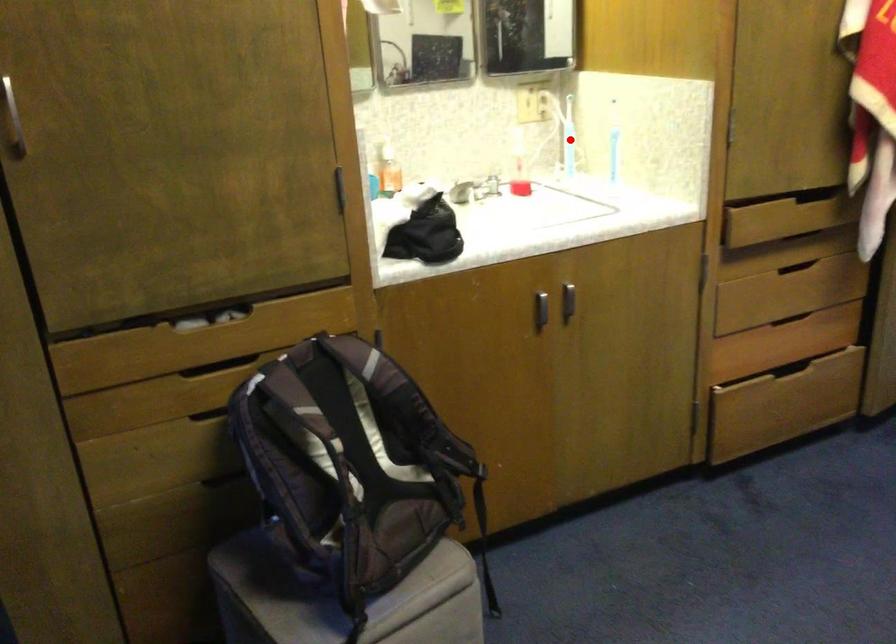
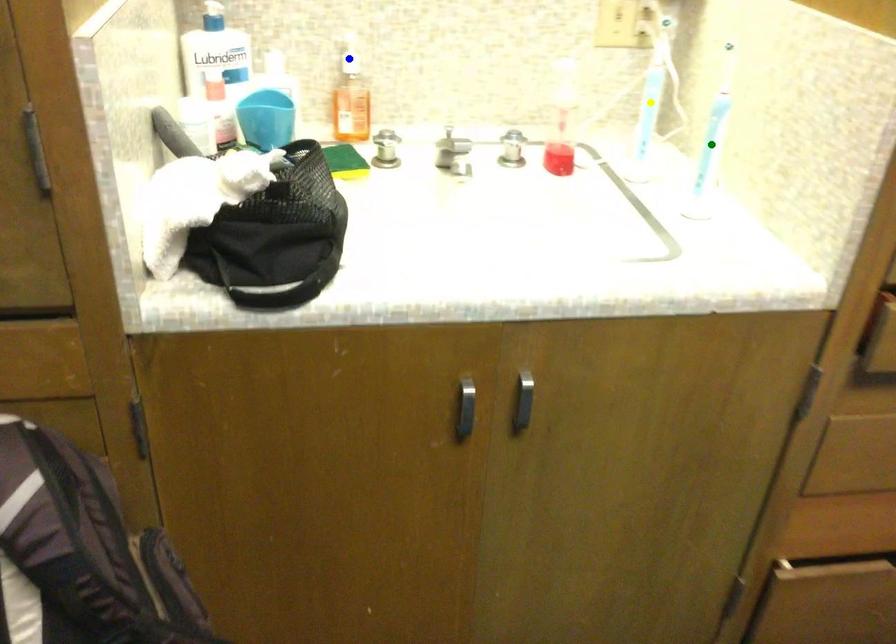
Question: I am providing you with two images of the same scene from different viewpoints. A red point is marked on the first image. You are given multiple points on the second image. In image 2, which mark is for the same physical point as the one in image 1?

Choices:
 (A) blue point
 (B) green point
 (C) yellow point

Answer: (C)